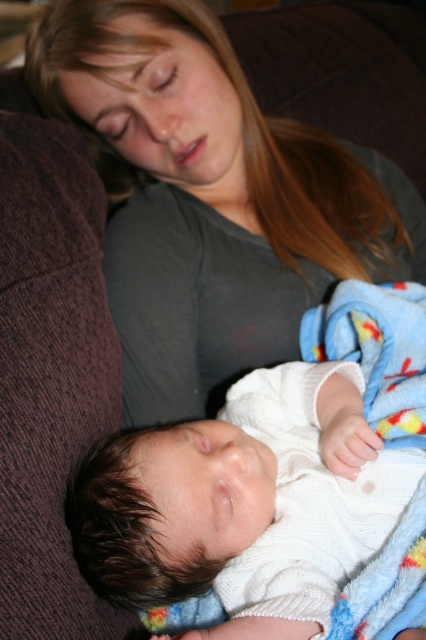
Question: Is matte gray shirt at upper center to the right of white knitted sweater at center from the viewer's perspective?

Choices:
 (A) no
 (B) yes

Answer: (A)

Question: Which point is farther from the camera taking this photo?

Choices:
 (A) (112, 240)
 (B) (256, 513)

Answer: (A)

Question: Can you confirm if matte gray shirt at upper center is positioned above white knitted sweater at center?

Choices:
 (A) no
 (B) yes

Answer: (B)

Question: Can you confirm if matte gray shirt at upper center is positioned to the right of white knitted sweater at center?

Choices:
 (A) no
 (B) yes

Answer: (A)

Question: Which point is farther to the camera?

Choices:
 (A) matte gray shirt at upper center
 (B) white knitted sweater at center

Answer: (A)